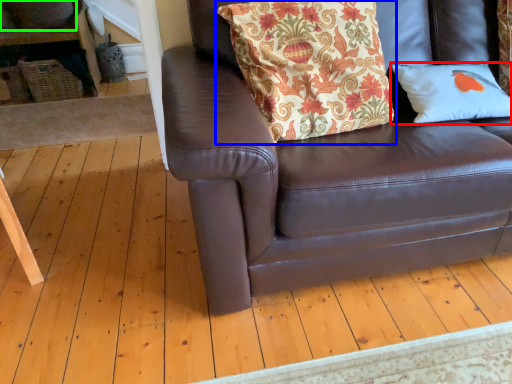
Question: Which object is positioned closest to pillow (highlighted by a red box)? Select from pillow (highlighted by a blue box) and gray (highlighted by a green box).

Choices:
 (A) pillow
 (B) gray

Answer: (A)